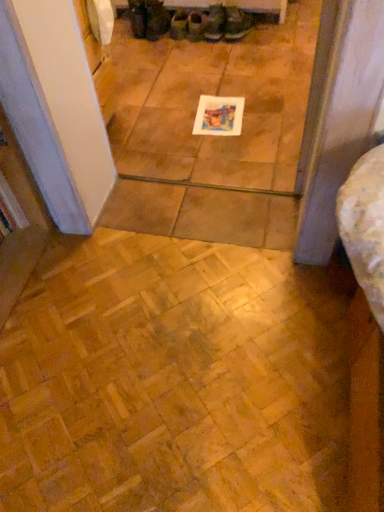
Where is `vacant area that lies in front of dark brown leather boot at upper center, the 2th footwear in the left-to-right sequence`? The width and height of the screenshot is (384, 512). vacant area that lies in front of dark brown leather boot at upper center, the 2th footwear in the left-to-right sequence is located at coordinates (163, 47).